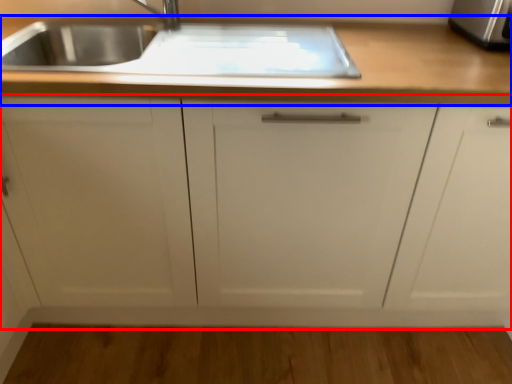
Question: Which of the following is the closest to the observer, cabinetry (highlighted by a red box) or countertop (highlighted by a blue box)?

Choices:
 (A) cabinetry
 (B) countertop

Answer: (A)